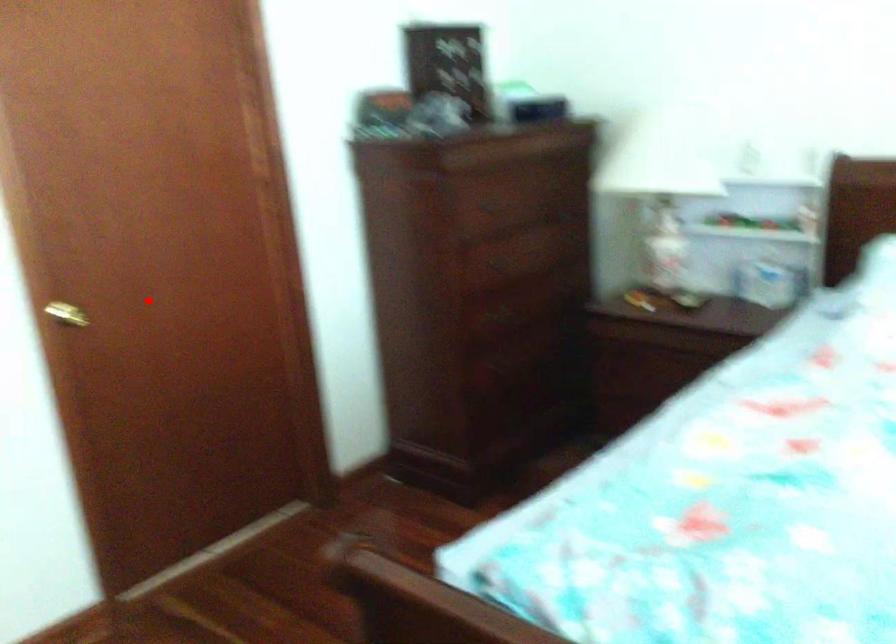
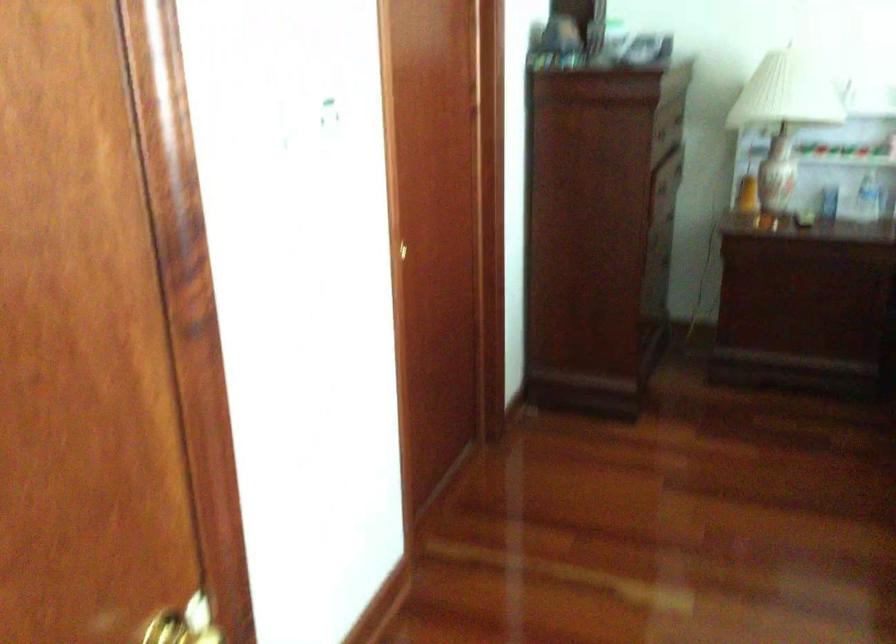
Find the pixel in the second image that matches the highlighted location in the first image.

(408, 250)